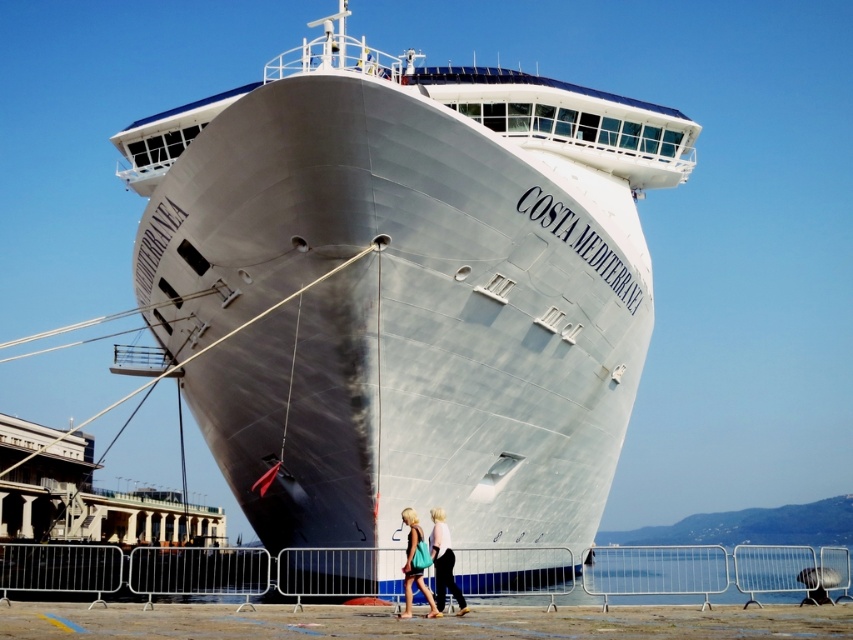
The width and height of the screenshot is (853, 640). What do you see at coordinates (405, 288) in the screenshot?
I see `polished steel ship at center` at bounding box center [405, 288].

Where is `polished steel ship at center`? The image size is (853, 640). polished steel ship at center is located at coordinates (405, 288).